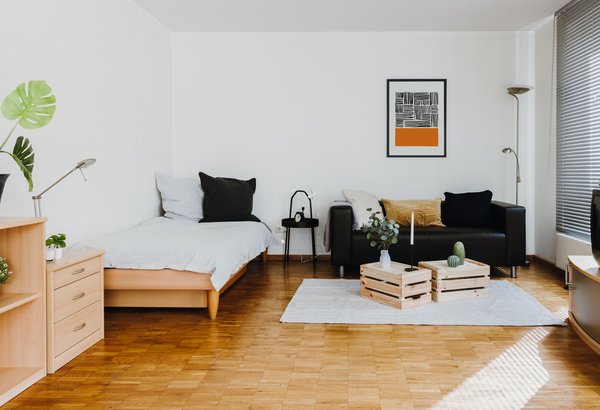
You are a GUI agent. You are given a task and a screenshot of the screen. Output one action in this format:
    pyautogui.click(x=<x>, y=<y>)
    Task: Click on the hardwood floor
    
    Given the screenshot: What is the action you would take?
    pyautogui.click(x=296, y=382)